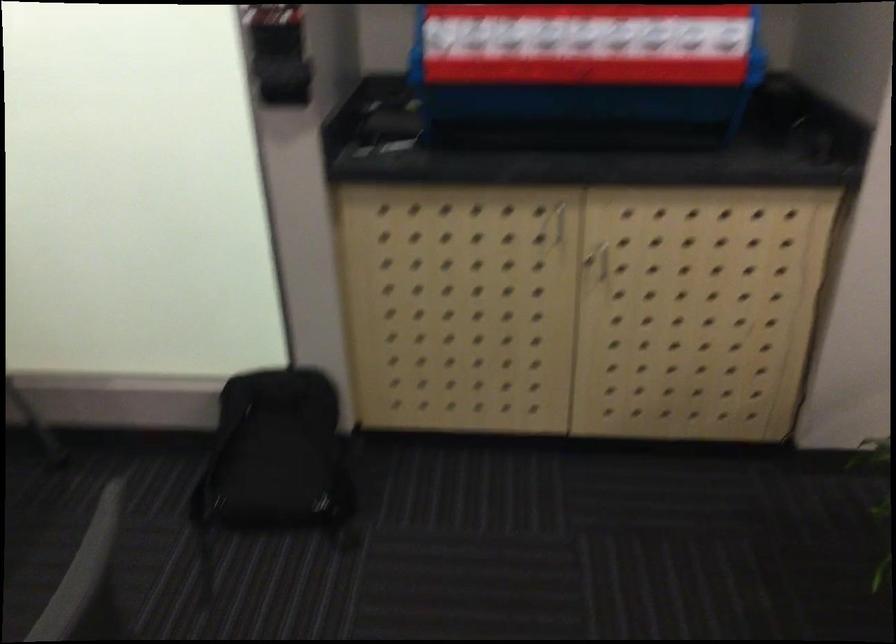
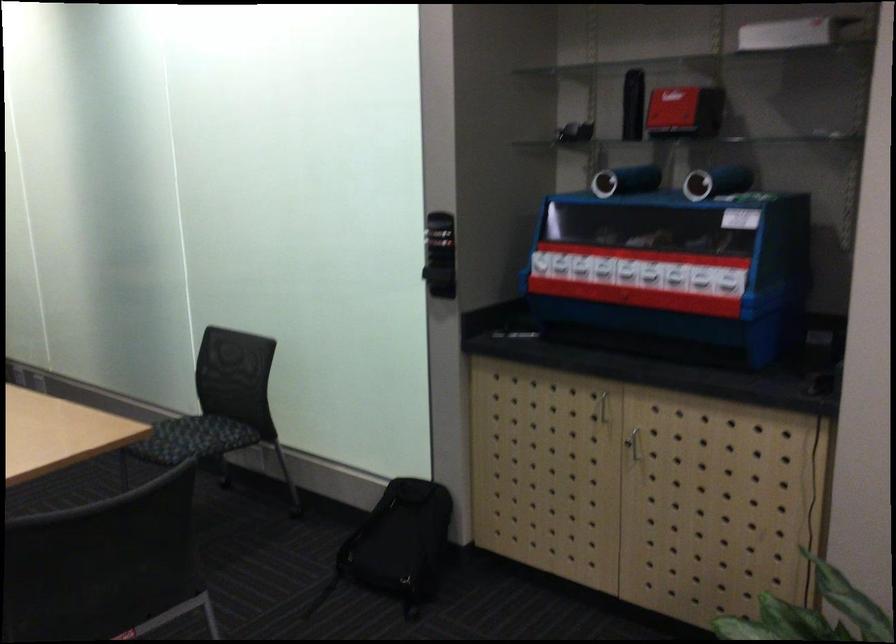
Locate, in the second image, the point that corresponds to [546,225] in the first image.

(601, 406)